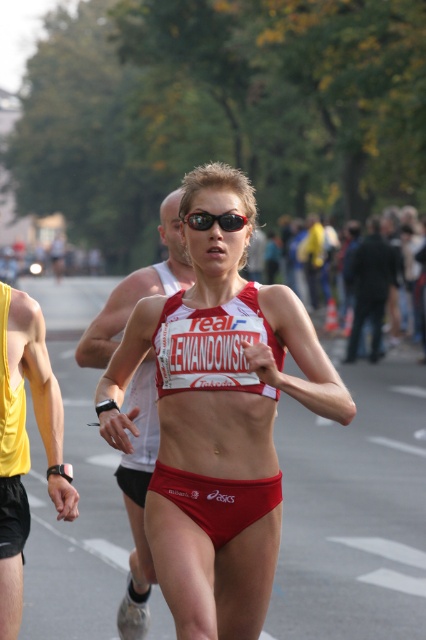
Consider the image. You are a photographer positioned at the camera location. You want to capture a closeup shot of the female runner in the marathon scene. The black fabric jacket at upper center is blocking your view. Can you estimate how far you need to move forward to get a clear shot without the jacket obstructing the runner?

The black fabric jacket at upper center is 21.39 meters away from the camera. To avoid obstruction, you would need to move forward beyond this distance, approximately 21.4 meters closer to the jacket, so that the jacket is no longer between you and the runner.

You are a photographer at the marathon event. You need to capture a photo where both the black fabric jacket at upper center and the black plastic sunglasses at center are visible. Based on their positions, which object should appear higher in the photo?

The black fabric jacket at upper center should appear higher in the photo because it is taller than the black plastic sunglasses at center.